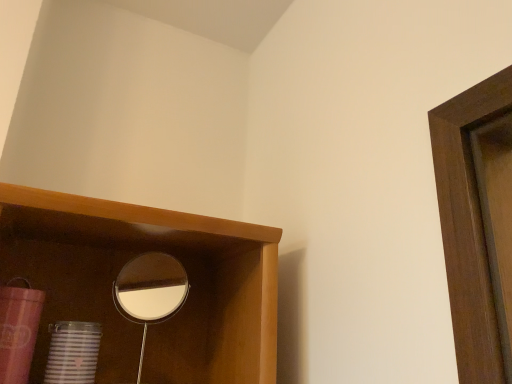
Identify the location of metallic reflective mirror at center. (150, 292).

What do you see at coordinates (150, 292) in the screenshot?
I see `metallic reflective mirror at center` at bounding box center [150, 292].

I want to click on metallic reflective mirror at center, so click(x=150, y=292).